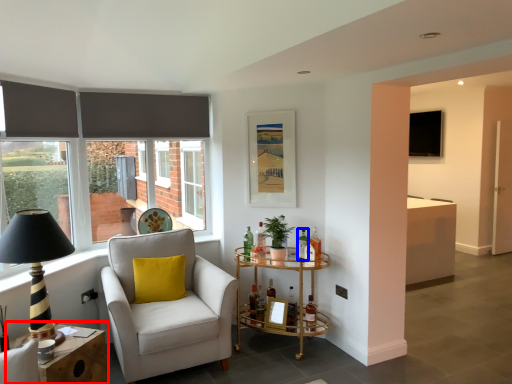
Question: Which point is closer to the camera, table (highlighted by a red box) or bottle (highlighted by a blue box)?

Choices:
 (A) table
 (B) bottle

Answer: (A)